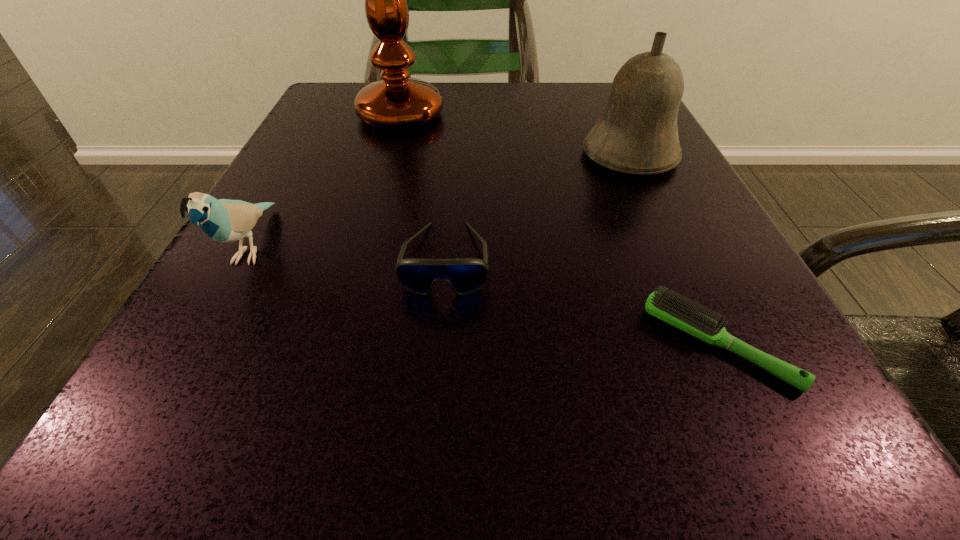
At what (x,y) coordinates should I click in order to perform the action: click on the tallest object. Please return your answer as a coordinate pair (x, y). Looking at the image, I should click on (395, 103).

This screenshot has width=960, height=540. Find the location of `bell`. bell is located at coordinates click(x=637, y=133).

This screenshot has height=540, width=960. In order to click on bird in this screenshot , I will do `click(223, 220)`.

You are a GUI agent. You are given a task and a screenshot of the screen. Output one action in this format:
    pyautogui.click(x=<x>, y=<y>)
    Task: Click on the second shortest object
    This screenshot has width=960, height=540.
    Given the screenshot: What is the action you would take?
    pyautogui.click(x=466, y=275)

Find the location of a particular element. This screenshot has width=960, height=540. the shortest object is located at coordinates (671, 308).

Find the location of `vacant space situated on the right of the table lamp`. vacant space situated on the right of the table lamp is located at coordinates (585, 114).

In order to click on free space located 0.120m on the left of the second tallest object in this screenshot , I will do `click(512, 156)`.

Where is `vacant space located at the face of the bird`? This screenshot has height=540, width=960. vacant space located at the face of the bird is located at coordinates (132, 465).

Where is `vacant space situated 0.190m on the front-facing side of the second shortest object`? vacant space situated 0.190m on the front-facing side of the second shortest object is located at coordinates (429, 466).

This screenshot has width=960, height=540. I want to click on free region located on the back of the shortest object, so click(632, 158).